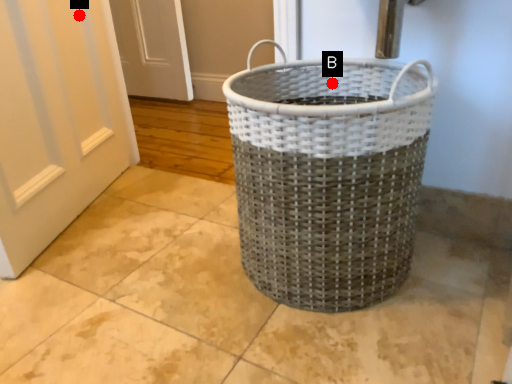
Question: Two points are circled on the image, labeled by A and B beside each circle. Which point appears closest to the camera in this image?

Choices:
 (A) A is closer
 (B) B is closer

Answer: (B)